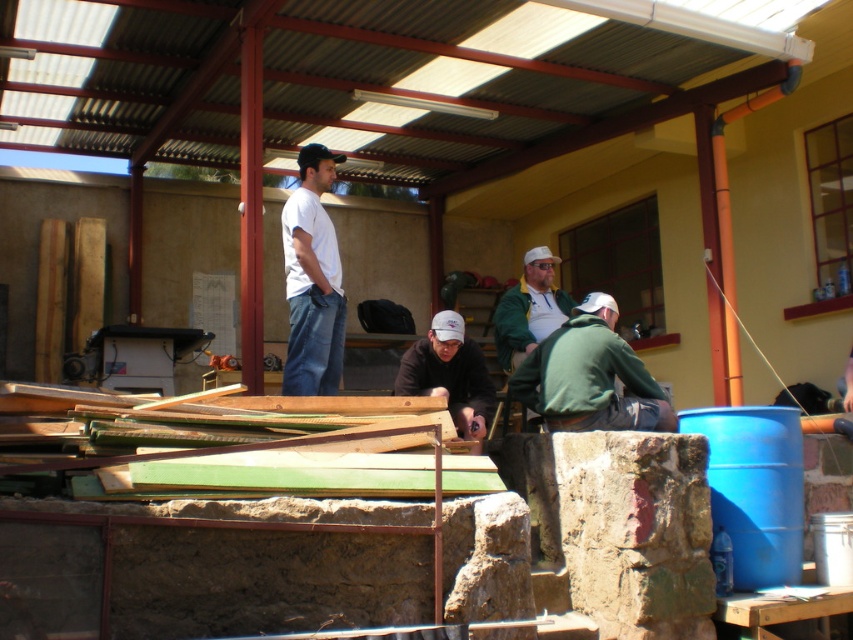
How much distance is there between white matte baseball cap at center and green fuzzy jacket at center?

A distance of 89.11 centimeters exists between white matte baseball cap at center and green fuzzy jacket at center.

Does white matte baseball cap at center appear under green fuzzy jacket at center?

Yes, white matte baseball cap at center is below green fuzzy jacket at center.

Who is more distant from viewer, (437,392) or (506,339)?

Point (506,339)

Identify the location of white matte baseball cap at center. (450, 374).

Between point (334, 378) and point (480, 440), which one is positioned behind?

Point (334, 378)

At what (x,y) coordinates should I click in order to perform the action: click on white cotton shirt at center. Please return your answer as a coordinate pair (x, y). The height and width of the screenshot is (640, 853). Looking at the image, I should click on (312, 280).

Who is higher up, green matte jacket at lower right or green fuzzy jacket at center?

Positioned higher is green fuzzy jacket at center.

Who is more distant from viewer, (558,403) or (525,260)?

Positioned behind is point (525,260).

I want to click on green matte jacket at lower right, so click(x=590, y=376).